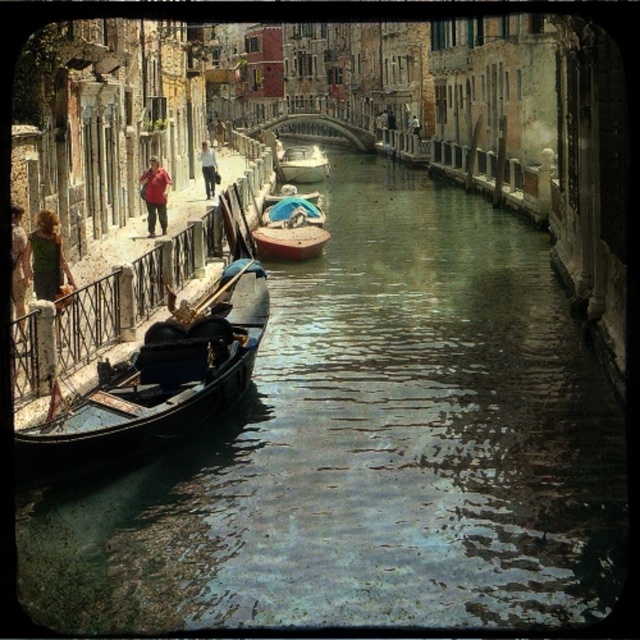
Question: Is greenish water at left to the left of green fabric shirt at left from the viewer's perspective?

Choices:
 (A) no
 (B) yes

Answer: (A)

Question: Which of the following is the farthest from the observer?

Choices:
 (A) tap(205, 145)
 (B) tap(156, 186)
 (C) tap(531, 257)
 (D) tap(289, 152)

Answer: (D)

Question: Among these objects, which one is nearest to the camera?

Choices:
 (A) red cotton shirt at left
 (B) green fabric shirt at left

Answer: (B)

Question: Which point is farther from the camera taking this photo?

Choices:
 (A) (256, 332)
 (B) (317, 218)
 (C) (20, 214)

Answer: (B)

Question: Can you confirm if greenish water at left is bigger than blue fabric boat at center?

Choices:
 (A) yes
 (B) no

Answer: (A)

Question: Is red cotton shirt at left positioned at the back of light brown leather jacket at upper left?

Choices:
 (A) yes
 (B) no

Answer: (B)